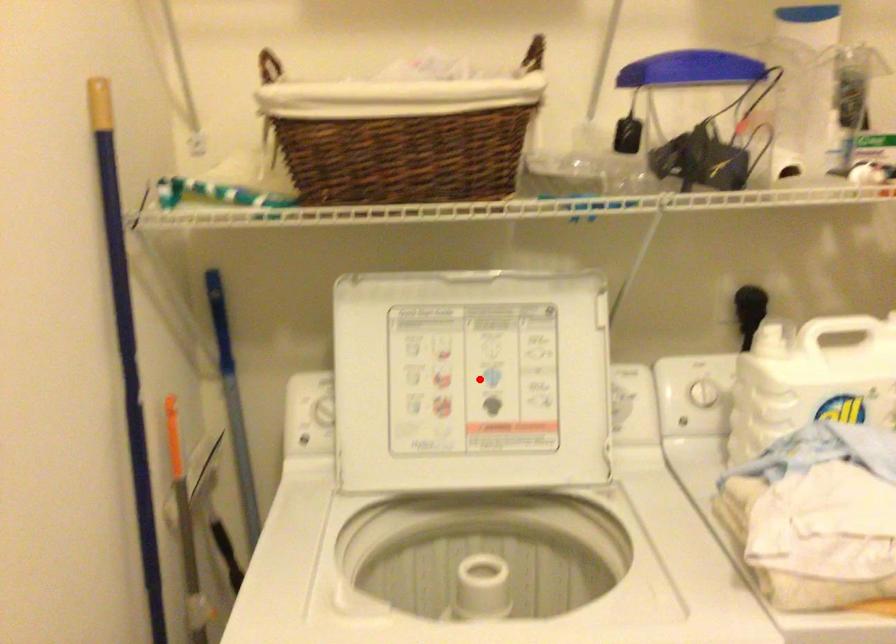
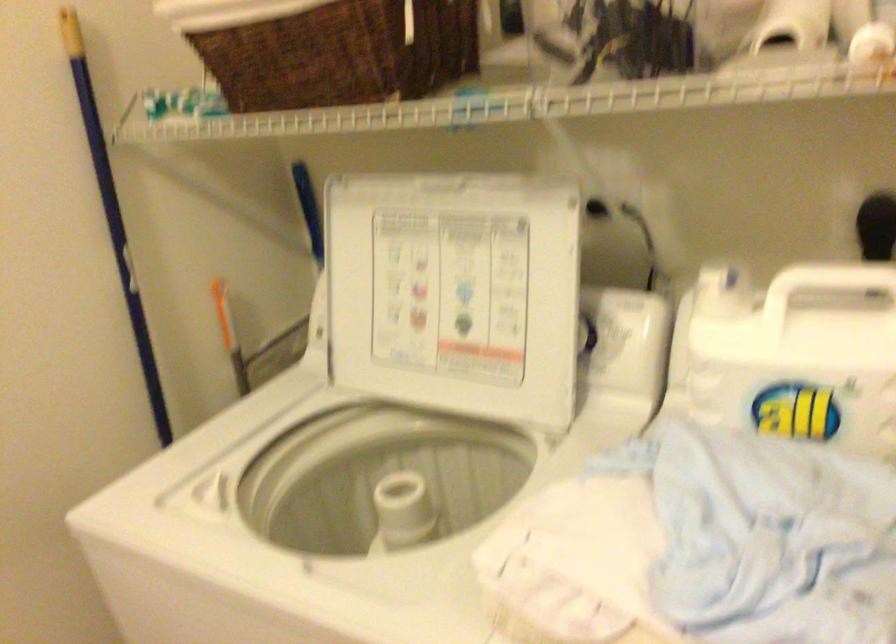
Question: I am providing you with two images of the same scene from different viewpoints. In image1, a red point is highlighted. Considering the same 3D point in image2, which of the following is correct?

Choices:
 (A) It is closer
 (B) It is farther

Answer: (A)